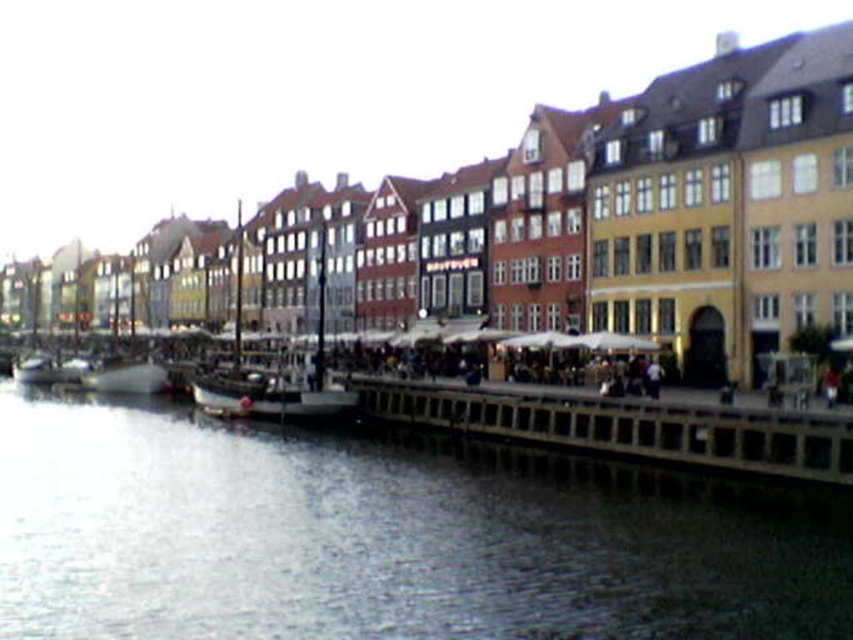
Question: Which of the following is the closest to the observer?

Choices:
 (A) (109, 364)
 (B) (653, 378)
 (C) (132, 493)
 (D) (19, 358)

Answer: (C)

Question: Does clear water at lower left have a larger size compared to metallic silver boat at left?

Choices:
 (A) no
 (B) yes

Answer: (B)

Question: Is clear water at lower left above wooden ship at center?

Choices:
 (A) no
 (B) yes

Answer: (A)

Question: Which object is farther from the camera taking this photo?

Choices:
 (A) white matte person at center
 (B) wooden ship at center
 (C) wooden dock at lower center
 (D) metallic silver boat at left

Answer: (D)

Question: Which object is closer to the camera taking this photo?

Choices:
 (A) wooden dock at lower center
 (B) wooden ship at center
 (C) white matte boat at lower left
 (D) clear water at lower left

Answer: (D)

Question: Can you confirm if clear water at lower left is thinner than wooden dock at lower center?

Choices:
 (A) no
 (B) yes

Answer: (A)